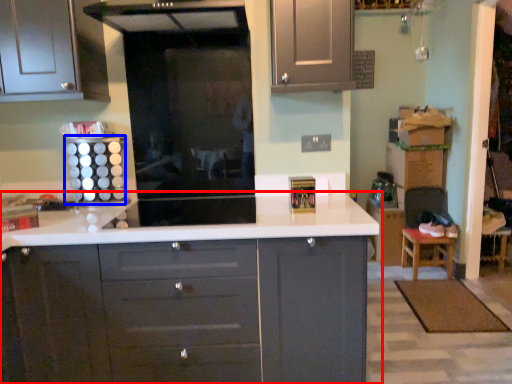
Question: Which point is closer to the camera, countertop (highlighted by a red box) or appliance (highlighted by a blue box)?

Choices:
 (A) countertop
 (B) appliance

Answer: (A)